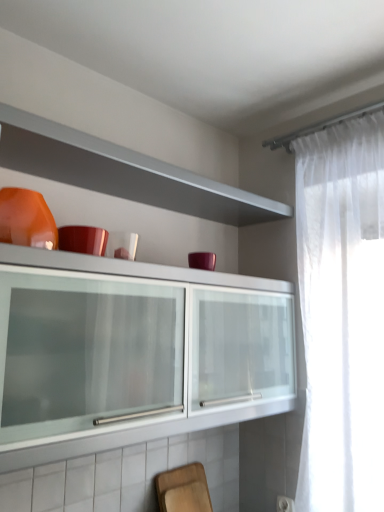
Question: Looking at the image, does wooden cutting board at lower center seem bigger or smaller compared to matte orange bowl at upper left?

Choices:
 (A) small
 (B) big

Answer: (A)

Question: Does point pos(200,501) appear closer or farther from the camera than point pos(44,220)?

Choices:
 (A) farther
 (B) closer

Answer: (A)

Question: Relative to matte orange bowl at upper left, is wooden cutting board at lower center in front or behind?

Choices:
 (A) behind
 (B) front

Answer: (A)

Question: Is matte orange bowl at upper left to the left or to the right of wooden cutting board at lower center in the image?

Choices:
 (A) right
 (B) left

Answer: (B)

Question: Based on their sizes in the image, would you say matte orange bowl at upper left is bigger or smaller than wooden cutting board at lower center?

Choices:
 (A) big
 (B) small

Answer: (A)

Question: Would you say matte orange bowl at upper left is inside or outside wooden cutting board at lower center?

Choices:
 (A) outside
 (B) inside

Answer: (A)

Question: Considering the positions of matte orange bowl at upper left and wooden cutting board at lower center in the image, is matte orange bowl at upper left wider or thinner than wooden cutting board at lower center?

Choices:
 (A) wide
 (B) thin

Answer: (A)